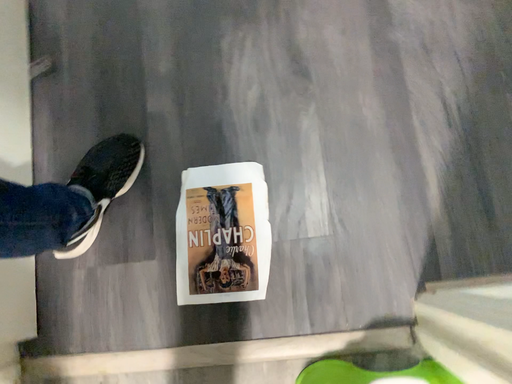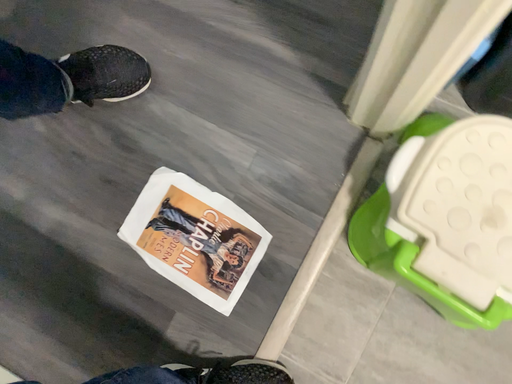
Question: Which way did the camera rotate in the video?

Choices:
 (A) rotated right
 (B) rotated left

Answer: (A)